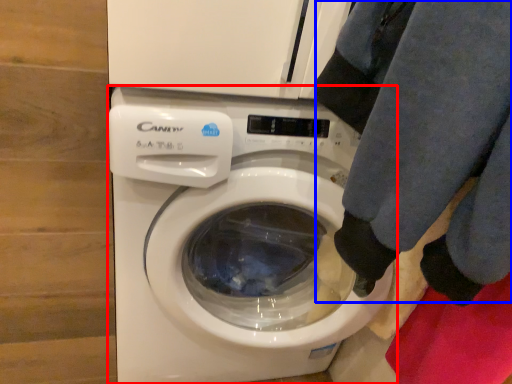
Question: Which object is closer to the camera taking this photo, washing machine (highlighted by a red box) or clothing (highlighted by a blue box)?

Choices:
 (A) washing machine
 (B) clothing

Answer: (B)